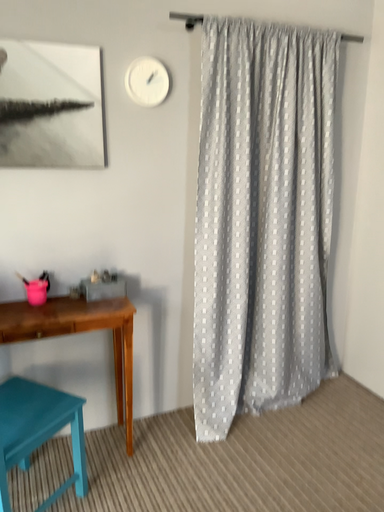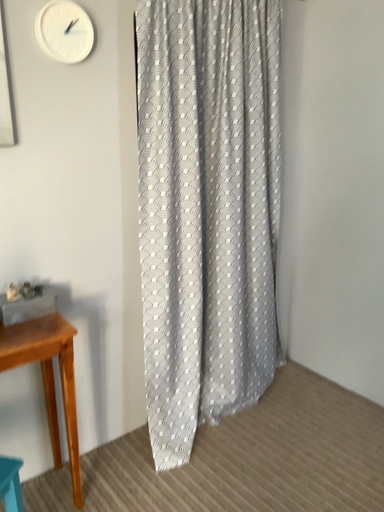
Question: Which way did the camera rotate in the video?

Choices:
 (A) rotated right
 (B) rotated left

Answer: (A)